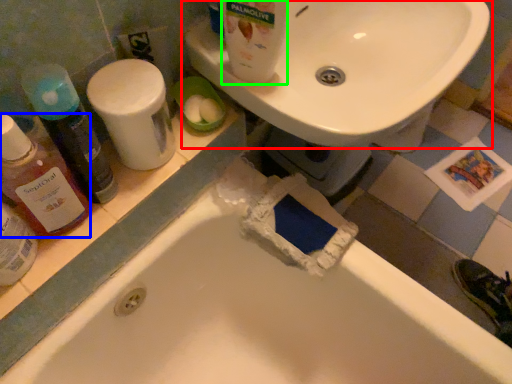
Question: Which object is the closest to the sink (highlighted by a red box)? Choose among these: cleaning product (highlighted by a blue box) or cleaning product (highlighted by a green box).

Choices:
 (A) cleaning product
 (B) cleaning product

Answer: (B)